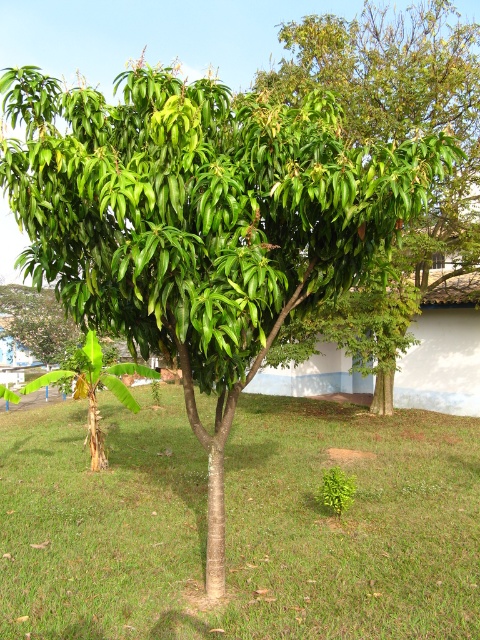
You are standing in the grassy area and want to walk from the green grass at center to the green glossy tree at center. Which direction should you move to reach the tree?

You should move to the right because the green grass at center is on the left side of the green glossy tree at center, so moving right will bring you towards the tree.

You are standing in front of the mango tree and want to reach both points. Which point, point (78, 540) or point (439, 260), will you reach first?

Point (78, 540) is closer to the viewer than point (439, 260), so you will reach point (78, 540) first.

You are standing at the base of the mango tree and want to place a small garden ornament exactly at the point marked by the coordinates point (239, 524). According to the image, what type of ground cover will the ornament be placed on?

The point (239, 524) corresponds to green grass at center, so the ornament will be placed on green grass at center.